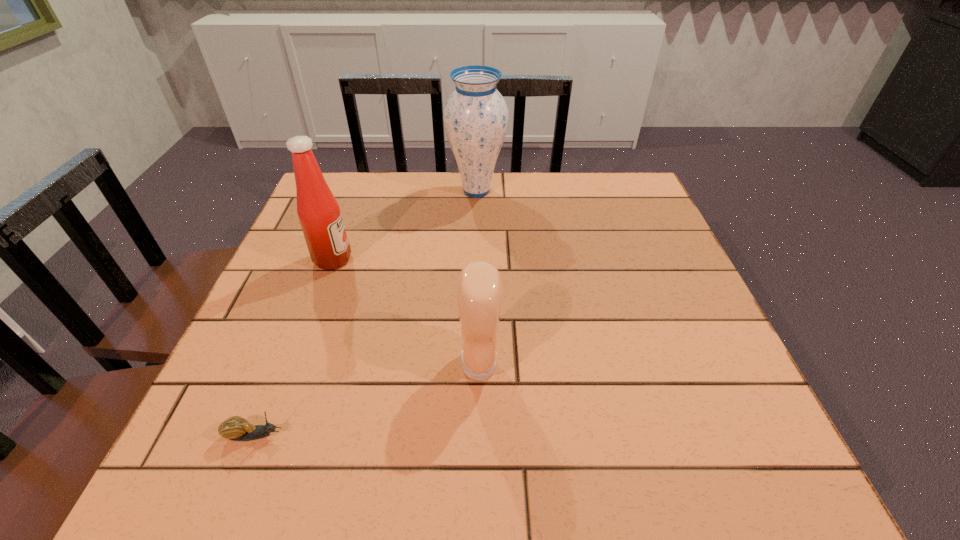
Find the location of a particular element. The width and height of the screenshot is (960, 540). vacant point located between the third nearest object and the vase is located at coordinates (405, 225).

This screenshot has width=960, height=540. In order to click on free space between the escargot and the third farthest object in this screenshot , I will do `click(368, 400)`.

Locate an element on the screen. The height and width of the screenshot is (540, 960). vacant region between the shorter condiment and the left condiment is located at coordinates (406, 312).

This screenshot has height=540, width=960. I want to click on vacant space that's between the vase and the farther condiment, so click(405, 225).

Where is `free area in between the nearer condiment and the nearest object`? Image resolution: width=960 pixels, height=540 pixels. free area in between the nearer condiment and the nearest object is located at coordinates (368, 400).

The height and width of the screenshot is (540, 960). I want to click on vacant space that is in between the nearest object and the farthest object, so click(366, 313).

Find the location of a particular element. The image size is (960, 540). free point between the taller condiment and the shortest object is located at coordinates (294, 347).

What are the coordinates of `free space between the third nearest object and the nearest object` in the screenshot? It's located at (294, 347).

Where is `vacant point located between the left condiment and the farthest object`? vacant point located between the left condiment and the farthest object is located at coordinates (405, 225).

Choose which object is the nearest neighbor to the shorter condiment. Please provide its 2D coordinates. Your answer should be formatted as a tuple, i.e. [(x, y)], where the tuple contains the x and y coordinates of a point satisfying the conditions above.

[(235, 428)]